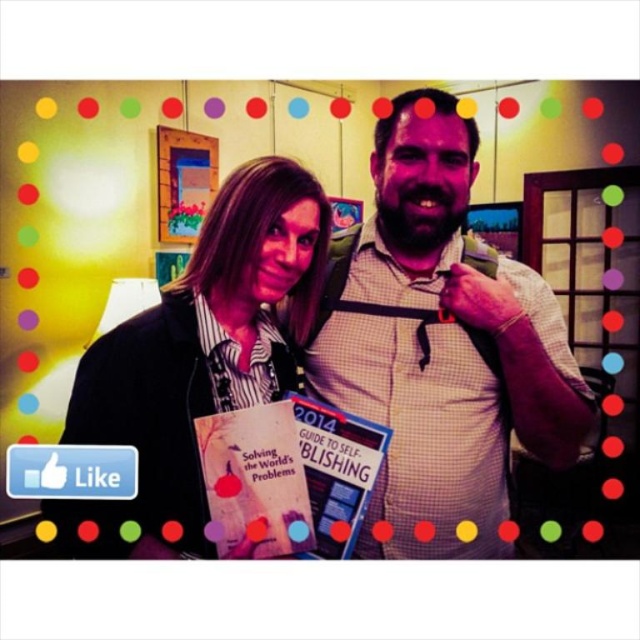
Question: Is white checkered shirt at center below matte black shirt at center?

Choices:
 (A) yes
 (B) no

Answer: (B)

Question: Which of the following is the closest to the observer?

Choices:
 (A) (294, 161)
 (B) (480, 262)

Answer: (B)

Question: Can you confirm if white checkered shirt at center is positioned above matte black shirt at center?

Choices:
 (A) no
 (B) yes

Answer: (B)

Question: Which point is closer to the camera taking this photo?

Choices:
 (A) (352, 282)
 (B) (196, 305)

Answer: (B)

Question: Among these objects, which one is farthest from the camera?

Choices:
 (A) white checkered shirt at center
 (B) matte black shirt at center

Answer: (A)

Question: Can you confirm if white checkered shirt at center is bigger than matte black shirt at center?

Choices:
 (A) no
 (B) yes

Answer: (B)